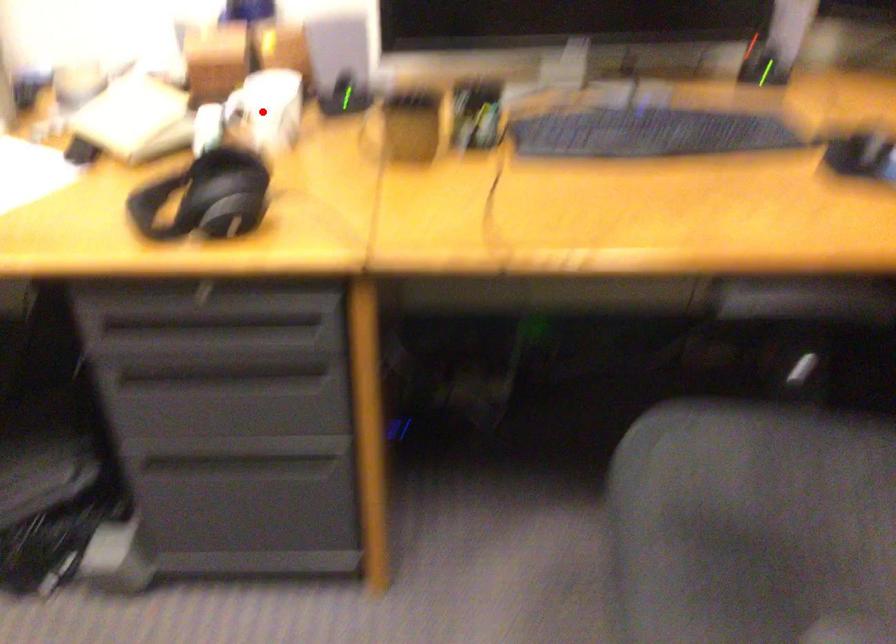
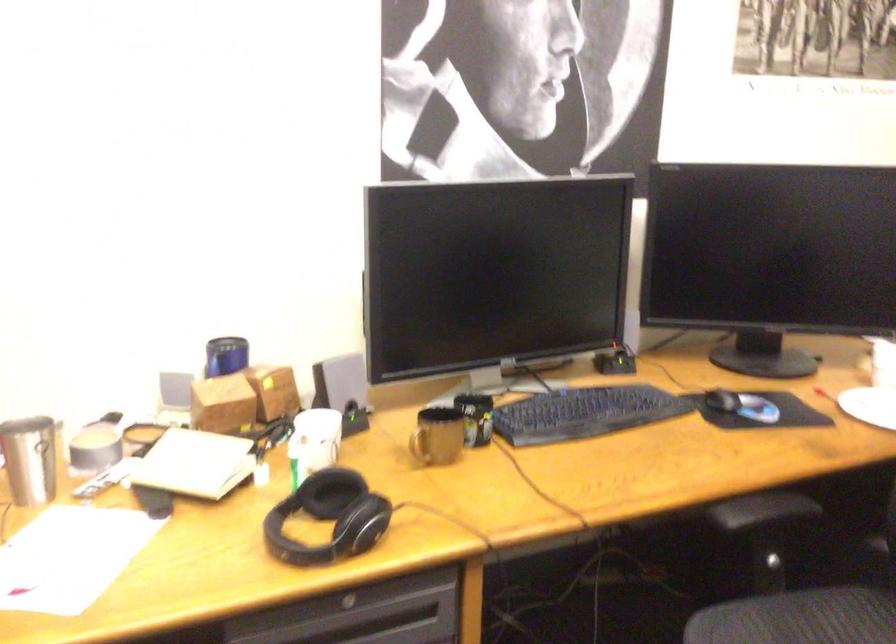
Locate, in the second image, the point that corresponds to the highlighted location in the first image.

(314, 440)